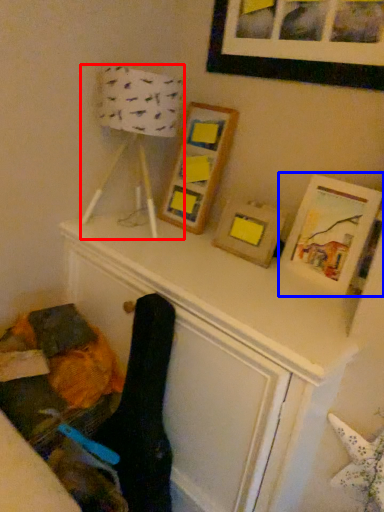
Question: Which of the following is the farthest to the observer, table lamp (highlighted by a red box) or picture frame (highlighted by a blue box)?

Choices:
 (A) table lamp
 (B) picture frame

Answer: (A)